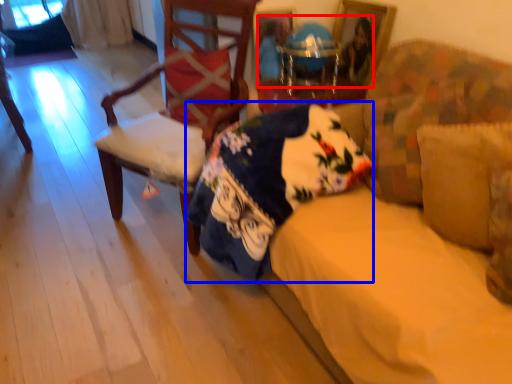
Question: Which object is closer to the camera taking this photo, couple (highlighted by a red box) or blanket (highlighted by a blue box)?

Choices:
 (A) couple
 (B) blanket

Answer: (B)